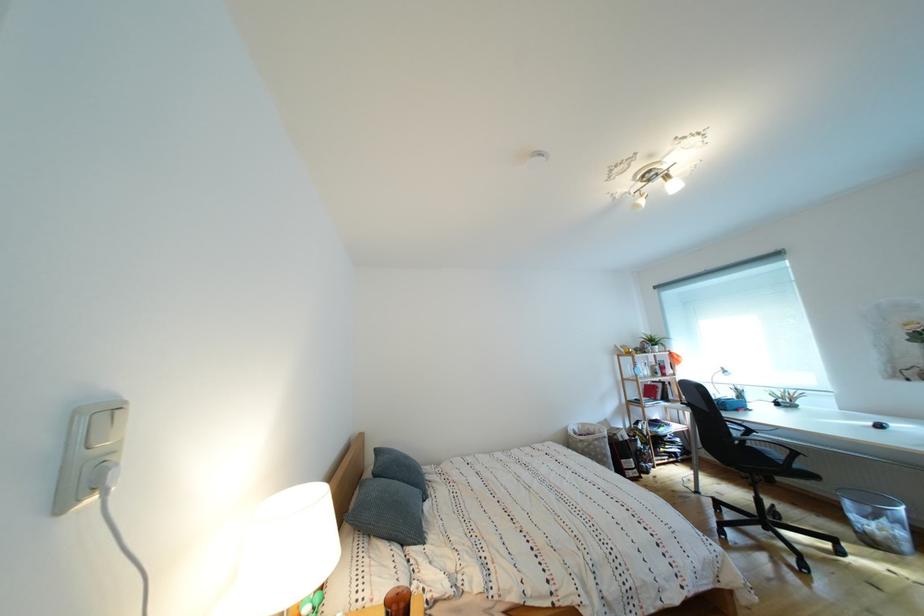
Find where to open the red book. Please return your answer as a coordinate pair (x, y).

(651, 390)